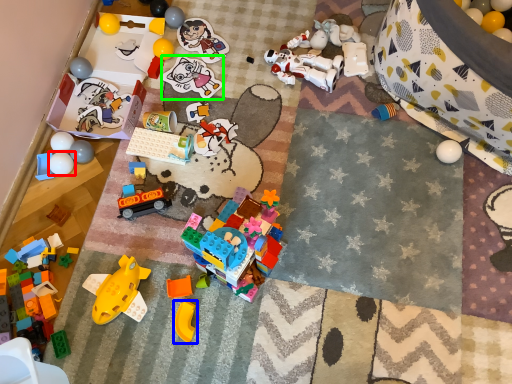
Question: Considering the real-world distances, which object is farthest from toy (highlighted by a red box)? toy (highlighted by a blue box) or toy (highlighted by a green box)?

Choices:
 (A) toy
 (B) toy

Answer: (A)